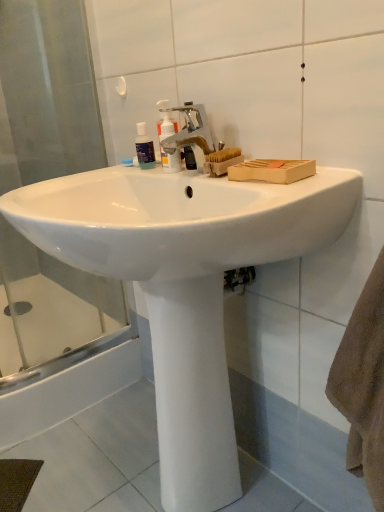
Question: From a real-world perspective, is white smooth pedestal at center located beneath silver metallic faucet at center?

Choices:
 (A) no
 (B) yes

Answer: (B)

Question: Is white smooth pedestal at center further to the viewer compared to silver metallic faucet at center?

Choices:
 (A) yes
 (B) no

Answer: (B)

Question: Considering the relative positions of white smooth pedestal at center and silver metallic faucet at center in the image provided, is white smooth pedestal at center to the left of silver metallic faucet at center from the viewer's perspective?

Choices:
 (A) no
 (B) yes

Answer: (B)

Question: Is white smooth pedestal at center positioned with its back to silver metallic faucet at center?

Choices:
 (A) yes
 (B) no

Answer: (B)

Question: Does white smooth pedestal at center have a lesser width compared to silver metallic faucet at center?

Choices:
 (A) no
 (B) yes

Answer: (A)

Question: Is transparent glass shower door at left to the left or to the right of silver metallic faucet at center in the image?

Choices:
 (A) right
 (B) left

Answer: (B)

Question: Based on their sizes in the image, would you say transparent glass shower door at left is bigger or smaller than silver metallic faucet at center?

Choices:
 (A) big
 (B) small

Answer: (A)

Question: Do you think transparent glass shower door at left is within silver metallic faucet at center, or outside of it?

Choices:
 (A) inside
 (B) outside

Answer: (B)

Question: Looking at their shapes, would you say transparent glass shower door at left is wider or thinner than silver metallic faucet at center?

Choices:
 (A) wide
 (B) thin

Answer: (B)

Question: Choose the correct answer: Is transparent glass shower door at left inside white smooth pedestal at center or outside it?

Choices:
 (A) outside
 (B) inside

Answer: (A)

Question: Considering the positions of transparent glass shower door at left and white smooth pedestal at center in the image, is transparent glass shower door at left wider or thinner than white smooth pedestal at center?

Choices:
 (A) wide
 (B) thin

Answer: (B)

Question: From the image's perspective, is transparent glass shower door at left above or below white smooth pedestal at center?

Choices:
 (A) below
 (B) above

Answer: (B)

Question: Is point (8, 55) closer or farther from the camera than point (233, 450)?

Choices:
 (A) farther
 (B) closer

Answer: (A)

Question: From a real-world perspective, is silver metallic faucet at center above or below white smooth pedestal at center?

Choices:
 (A) above
 (B) below

Answer: (A)

Question: Considering the positions of point (165, 140) and point (198, 287), is point (165, 140) closer or farther from the camera than point (198, 287)?

Choices:
 (A) closer
 (B) farther

Answer: (B)